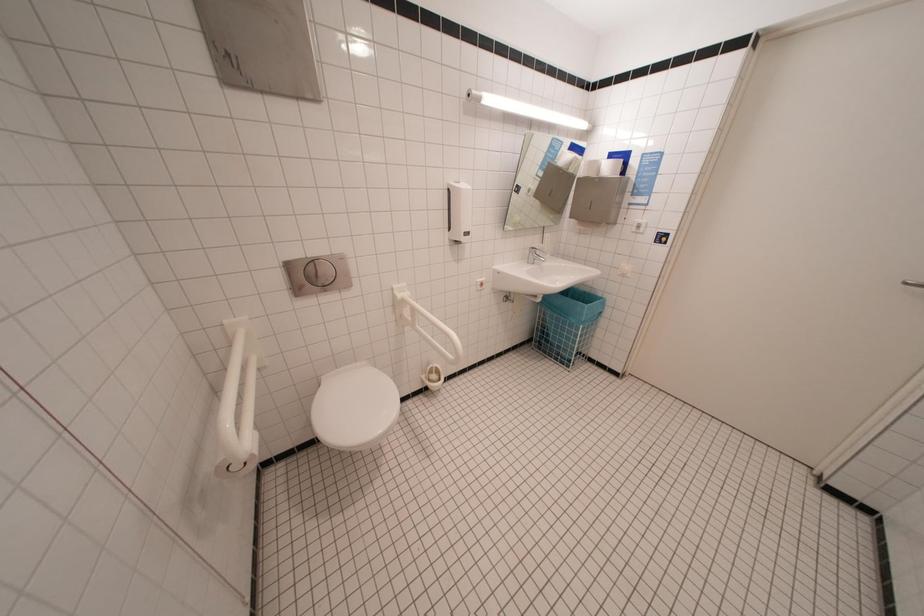
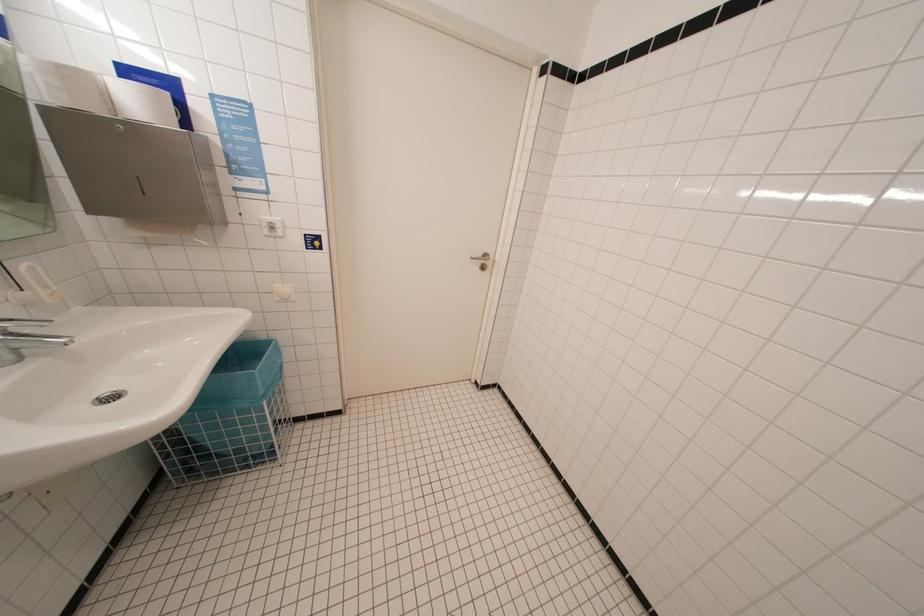
The images are taken continuously from a first-person perspective. In which direction is your viewpoint rotating?

The camera's rotation is toward right-down.